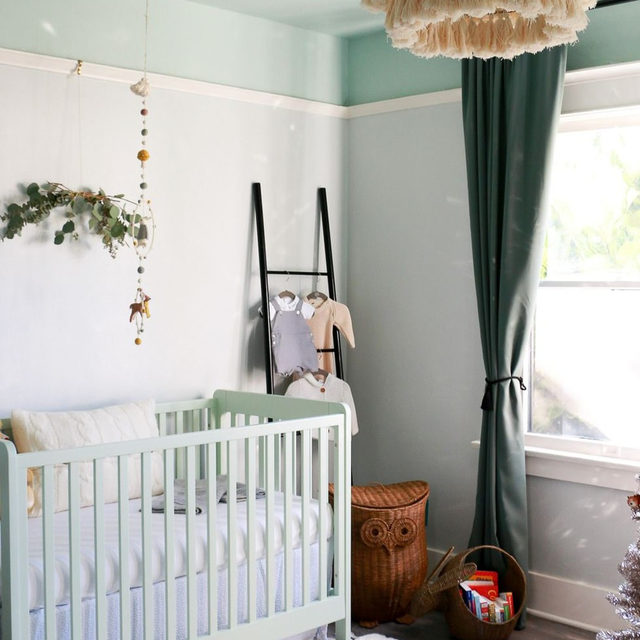
I want to click on corner, so click(338, 166).